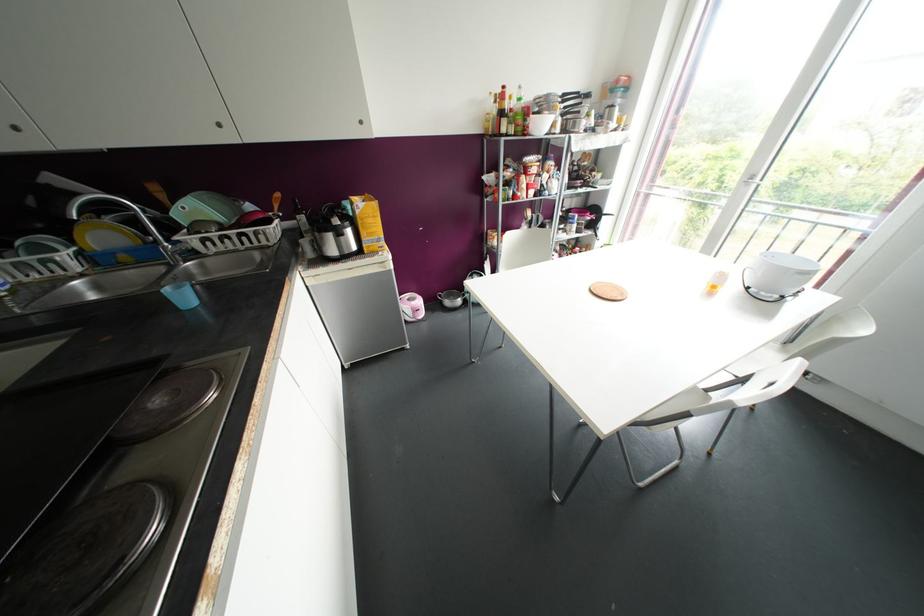
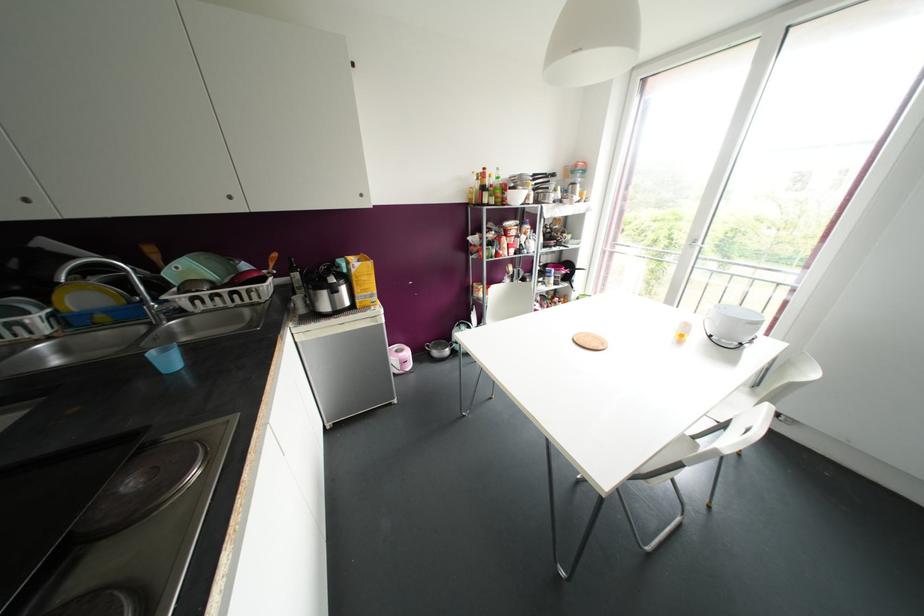
In the second image, find the point that corresponds to (370,220) in the first image.

(363, 277)